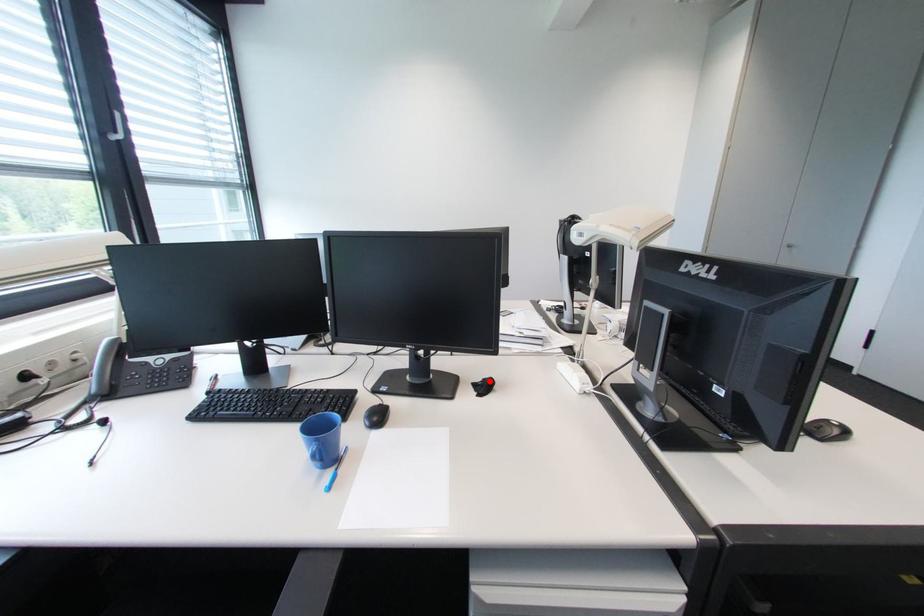
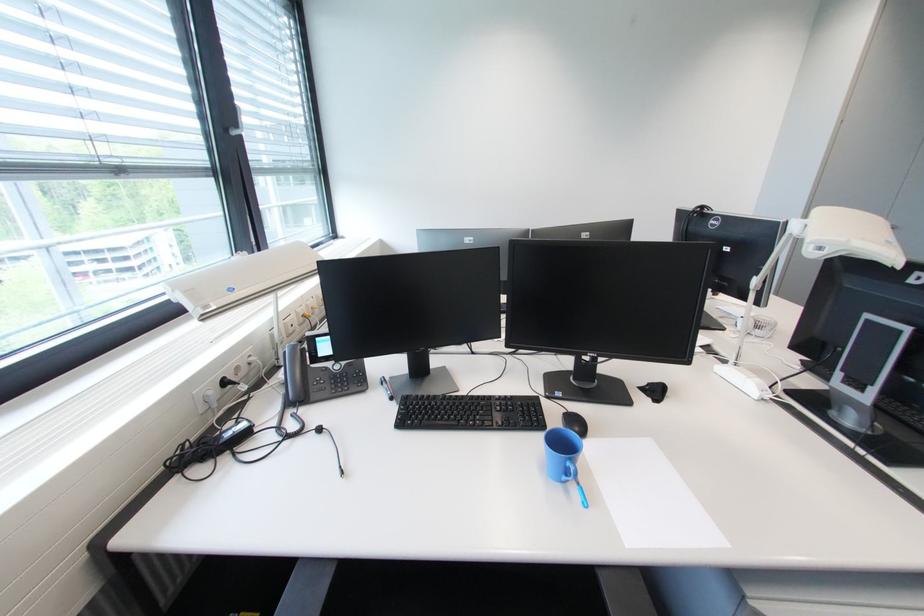
The point at the highlighted location is marked in the first image. Where is the corresponding point in the second image?

(655, 386)